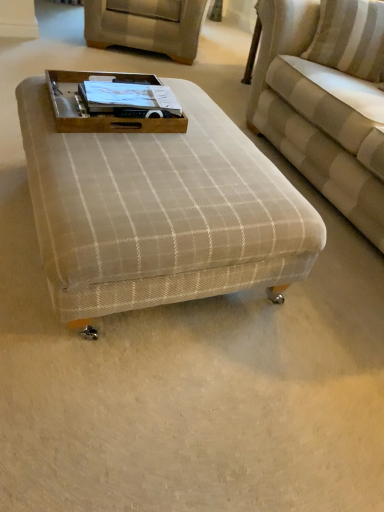
This screenshot has width=384, height=512. Find the location of `free space above brown wooden tray at center (from a real-world perspective)`. free space above brown wooden tray at center (from a real-world perspective) is located at coordinates (115, 92).